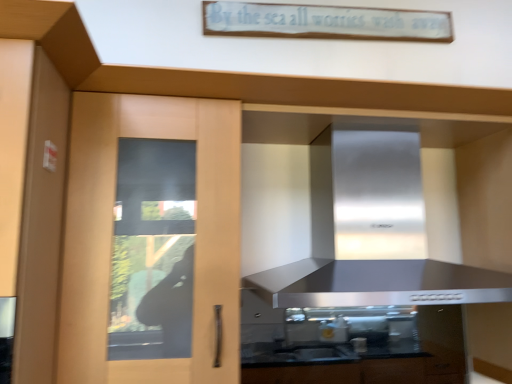
The width and height of the screenshot is (512, 384). Describe the element at coordinates (364, 234) in the screenshot. I see `stainless steel hood at center` at that location.

In order to click on stainless steel hood at center in this screenshot , I will do `click(364, 234)`.

What is the approximate height of stainless steel hood at center?

stainless steel hood at center is 19.80 inches tall.

Measure the distance between stainless steel hood at center and camera.

They are 1.06 meters apart.

In order to click on stainless steel hood at center in this screenshot , I will do `click(364, 234)`.